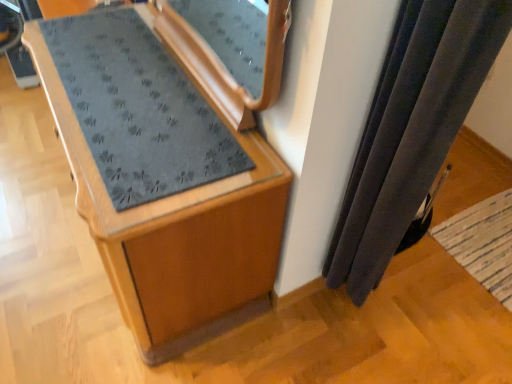
You are a GUI agent. You are given a task and a screenshot of the screen. Output one action in this format:
    pyautogui.click(x=<x>, y=<y>)
    Task: Click on the vacant space that is to the left of wooden cabinet at center
    Image resolution: width=512 pixels, height=384 pixels.
    Given the screenshot: What is the action you would take?
    click(39, 206)